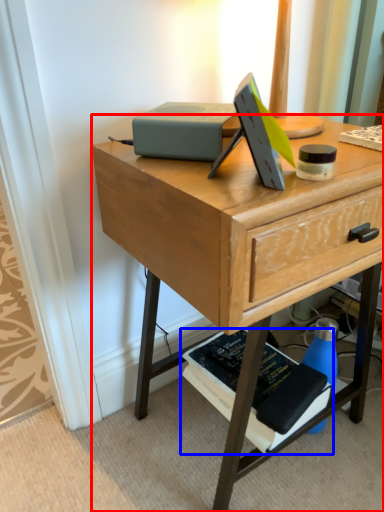
Question: Among these objects, which one is farthest to the camera, desk (highlighted by a red box) or paperback book (highlighted by a blue box)?

Choices:
 (A) desk
 (B) paperback book

Answer: (B)